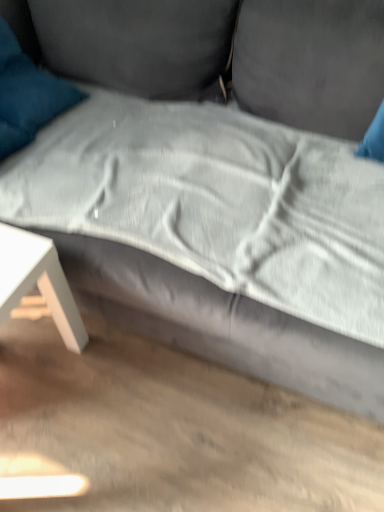
Question: From the image's perspective, is teal soft cushion at upper left located above or below white matte table at lower left?

Choices:
 (A) below
 (B) above

Answer: (B)

Question: From a real-world perspective, is teal soft cushion at upper left above or below white matte table at lower left?

Choices:
 (A) above
 (B) below

Answer: (A)

Question: Relative to white matte table at lower left, is teal soft cushion at upper left in front or behind?

Choices:
 (A) front
 (B) behind

Answer: (B)

Question: In terms of width, does white matte table at lower left look wider or thinner when compared to teal soft cushion at upper left?

Choices:
 (A) thin
 (B) wide

Answer: (A)

Question: Considering the positions of point (13, 250) and point (66, 86), is point (13, 250) closer or farther from the camera than point (66, 86)?

Choices:
 (A) closer
 (B) farther

Answer: (A)

Question: From a real-world perspective, is white matte table at lower left positioned above or below teal soft cushion at upper left?

Choices:
 (A) below
 (B) above

Answer: (A)

Question: In terms of size, does white matte table at lower left appear bigger or smaller than teal soft cushion at upper left?

Choices:
 (A) small
 (B) big

Answer: (B)